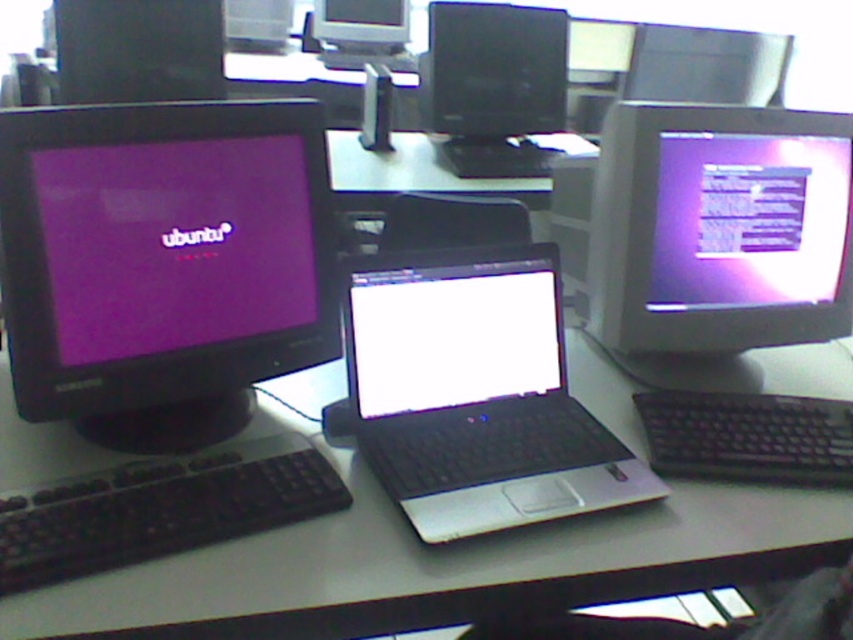
Question: Can you confirm if black plastic computer desk at center is positioned above matte black monitor at upper center?

Choices:
 (A) yes
 (B) no

Answer: (B)

Question: Which of these objects is positioned closest to the black plastic mouse at center?

Choices:
 (A) matte black monitor at upper left
 (B) black plastic computer desk at center
 (C) black plastic keyboard at lower left

Answer: (C)

Question: Which point is closer to the camera?

Choices:
 (A) black plastic keyboard at lower right
 (B) black plastic laptop at center
 (C) black plastic computer desk at center
 (D) matte purple monitor at right

Answer: (C)

Question: Can you confirm if black plastic laptop at center is thinner than white glossy laptop at center?

Choices:
 (A) yes
 (B) no

Answer: (B)

Question: Estimate the real-world distances between objects in this image. Which object is farther from the matte black monitor at upper left?

Choices:
 (A) matte black monitor at left
 (B) black plastic keyboard at lower right
 (C) matte black monitor at upper center
 (D) black plastic keyboard at lower left

Answer: (B)

Question: Considering the relative positions of white glossy laptop at center and black glossy monitor at upper center in the image provided, where is white glossy laptop at center located with respect to black glossy monitor at upper center?

Choices:
 (A) right
 (B) left

Answer: (B)